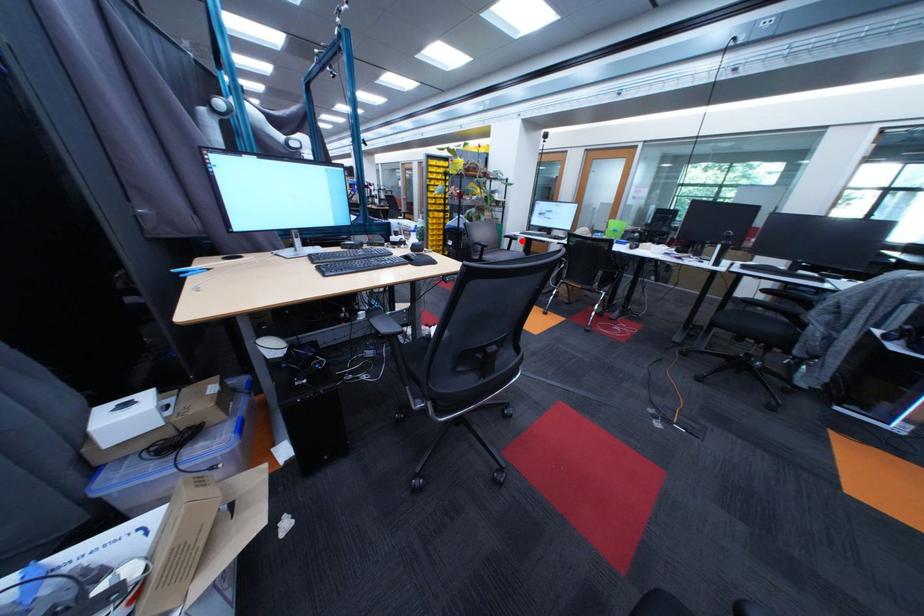
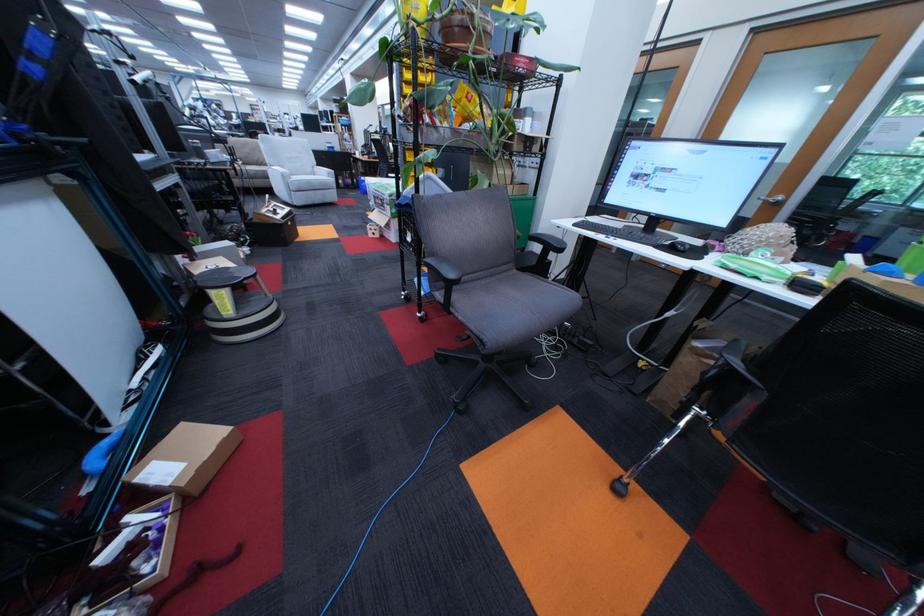
Locate, in the second image, the point that corresponds to the highlighted location in the first image.

(552, 249)